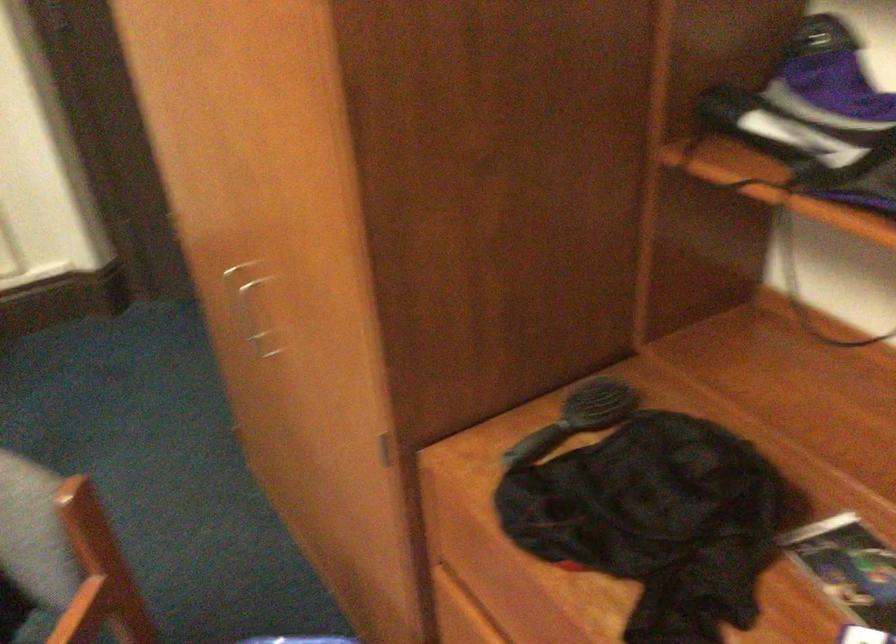
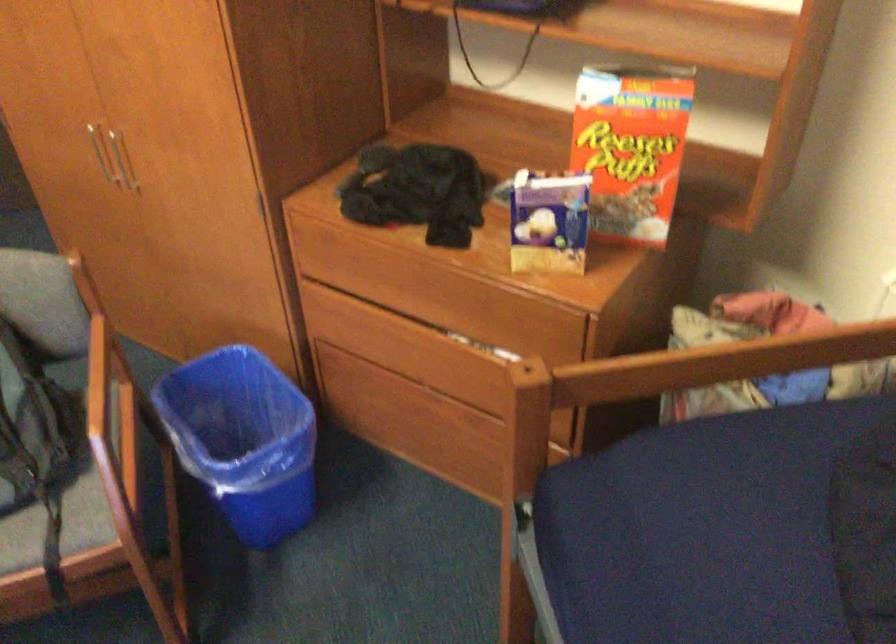
Question: I am providing you with two images of the same scene from different viewpoints. After the viewpoint changes to image2, which objects are now occluded?

Choices:
 (A) backpack strap
 (B) chair sitting surface
 (C) blue trash can
 (D) none of these

Answer: (D)